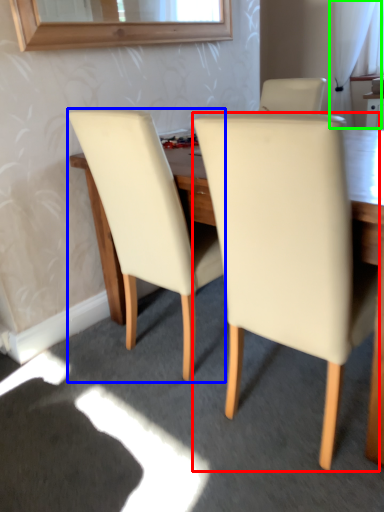
Question: Estimate the real-world distances between objects in this image. Which object is farther from chair (highlighted by a red box), chair (highlighted by a blue box) or curtain (highlighted by a green box)?

Choices:
 (A) chair
 (B) curtain

Answer: (B)